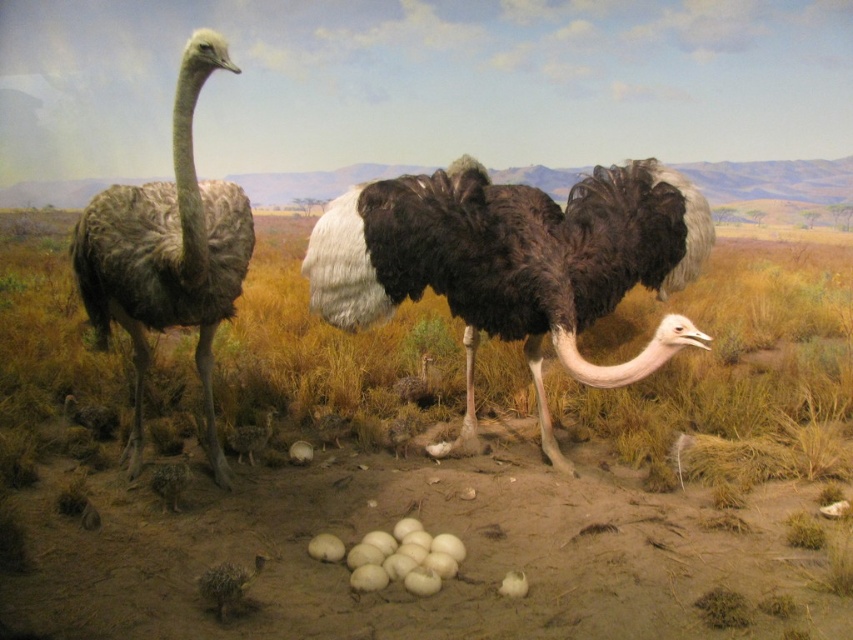
Locate an element on the screen. brown sandy dirt at center is located at coordinates (433, 467).

Is brown sandy dirt at center further to camera compared to dark brown feathers at left?

Yes, brown sandy dirt at center is further from the viewer.

Describe the element at coordinates (433, 467) in the screenshot. The width and height of the screenshot is (853, 640). I see `brown sandy dirt at center` at that location.

At what (x,y) coordinates should I click in order to perform the action: click on brown sandy dirt at center. Please return your answer as a coordinate pair (x, y). The width and height of the screenshot is (853, 640). Looking at the image, I should click on [x=433, y=467].

Is dark brown feathers at center positioned in front of dark brown feathers at left?

That is False.

Is dark brown feathers at center taller than dark brown feathers at left?

Incorrect, dark brown feathers at center's height is not larger of dark brown feathers at left's.

Who is more forward, (x=434, y=284) or (x=216, y=193)?

Point (x=216, y=193) is more forward.

At what (x,y) coordinates should I click in order to perform the action: click on dark brown feathers at center. Please return your answer as a coordinate pair (x, y). Looking at the image, I should click on (514, 262).

Does brown sandy dirt at center have a lesser width compared to dark brown feathers at center?

Yes, brown sandy dirt at center is thinner than dark brown feathers at center.

Is brown sandy dirt at center shorter than dark brown feathers at center?

Correct, brown sandy dirt at center is not as tall as dark brown feathers at center.

Is point (735, 298) farther from viewer compared to point (476, 435)?

That is True.

Find the location of `brown sandy dirt at center`. brown sandy dirt at center is located at coordinates (433, 467).